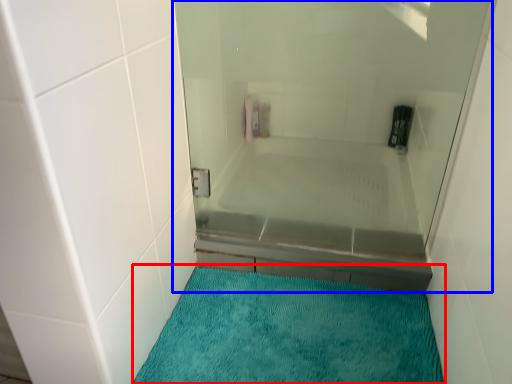
Question: Which object appears farthest to the camera in this image, bath mat (highlighted by a red box) or shower door (highlighted by a blue box)?

Choices:
 (A) bath mat
 (B) shower door

Answer: (B)